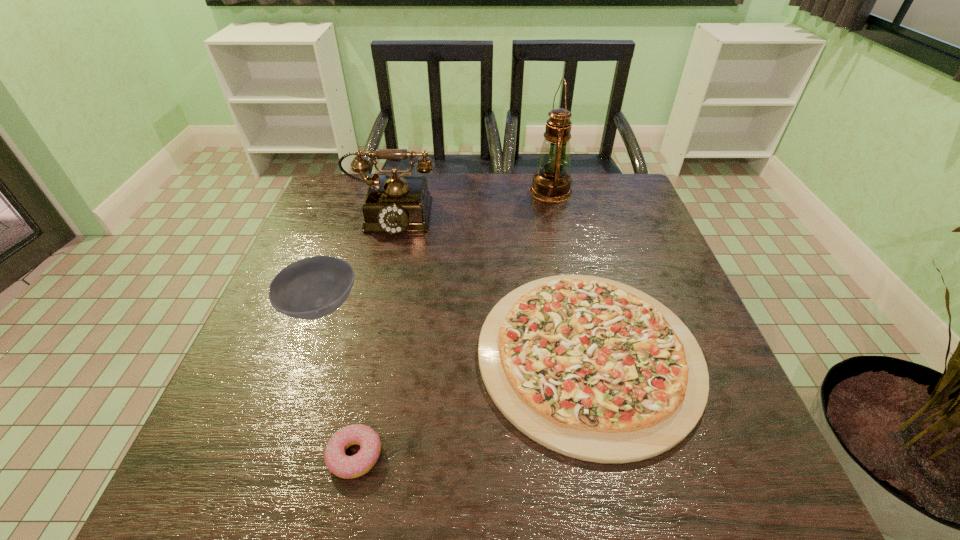
Locate an element on the screen. This screenshot has width=960, height=540. free location at the near edge of the desktop is located at coordinates (665, 470).

I want to click on vacant space at the left edge of the desktop, so click(x=289, y=414).

I want to click on vacant area at the right edge of the desktop, so click(x=659, y=240).

You are a GUI agent. You are given a task and a screenshot of the screen. Output one action in this format:
    pyautogui.click(x=<x>, y=<y>)
    Task: Click on the vacant area at the near left corner
    The width and height of the screenshot is (960, 540).
    Given the screenshot: What is the action you would take?
    pyautogui.click(x=271, y=457)

Image resolution: width=960 pixels, height=540 pixels. Find the location of `vacant region at the far right corner of the desktop`. vacant region at the far right corner of the desktop is located at coordinates (586, 204).

This screenshot has height=540, width=960. I want to click on free space at the near right corner of the desktop, so click(748, 472).

Locate an element on the screen. Image resolution: width=960 pixels, height=540 pixels. empty space that is in between the doughnut and the third shortest object is located at coordinates (338, 381).

Locate an element on the screen. The width and height of the screenshot is (960, 540). free area in between the telephone and the bowl is located at coordinates (356, 260).

Identify the location of free space between the telephone and the tallest object. (471, 201).

You are a GUI agent. You are given a task and a screenshot of the screen. Output one action in this format:
    pyautogui.click(x=<x>, y=<y>)
    Task: Click on the free point between the pizza and the doughnut
    
    Given the screenshot: What is the action you would take?
    pyautogui.click(x=472, y=405)